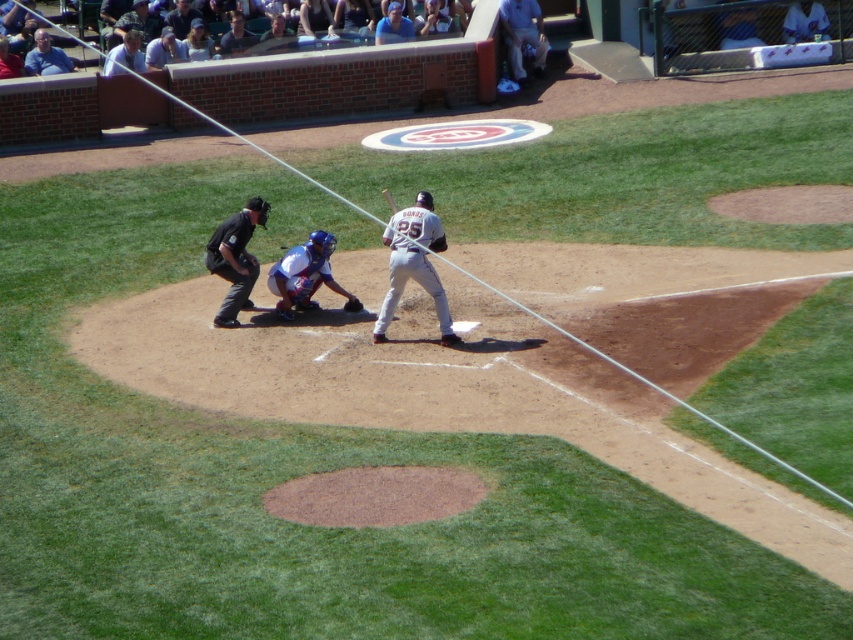
You are a photographer at the baseball stadium. You want to take a photo of the gray uniformed player at center. The stadium has a rule that you must stand exactly at point (x=415, y=262) to take the photo. Can you confirm if this point is the correct location to capture the player?

Yes, the point (x=415, y=262) corresponds to the gray uniformed player at center, so standing there will allow you to capture the player in the photo.

You are a spectator at the baseball game and want to know if the gray uniformed player at center is positioned higher than the brown leather glove at center. Can you confirm this based on the scene?

Yes, the gray uniformed player at center is positioned above the brown leather glove at center, so they are higher up.